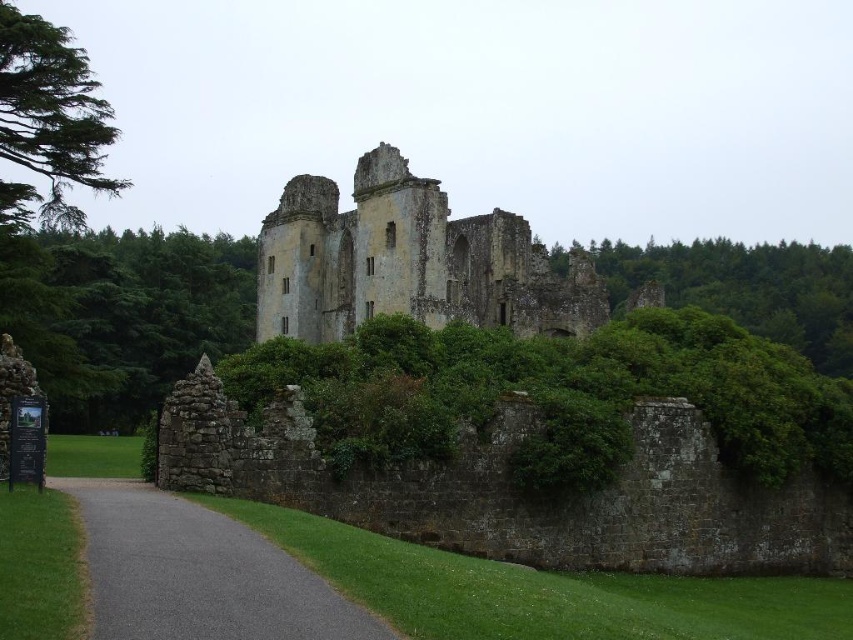
You are standing at the entrance of the historic stone structure and want to walk towards the point labeled as point (248,540). Which direction should you walk relative to the other point labeled point (341,260)?

You should walk towards point (248,540), which is in front of point (341,260). Since point (341,260) is behind point (248,540), moving towards the closer point would mean heading toward the one that is in front.

You are standing at the entrance of the weathered stone castle at center. If you walk straight ahead, will you eventually reach the castle itself?

Yes, since you are already at the entrance of the weathered stone castle at center, walking straight ahead would lead you into the castle.

You are a tourist standing at the entrance of the weathered stone castle at center. You want to take a photo of the gray asphalt path at lower left. In which direction should you turn to get the best view of the path?

To capture the gray asphalt path at lower left, you should turn to your left since the weathered stone castle at center is positioned to the right of the path, allowing the path to be clearly visible when facing away from the castle.